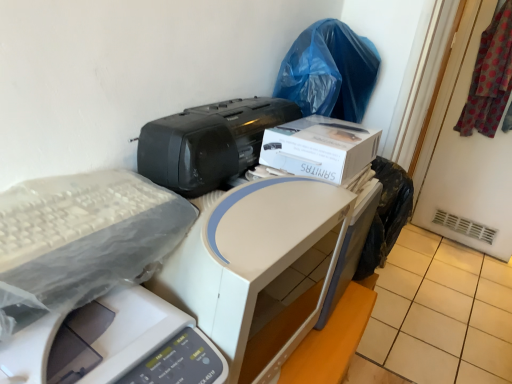
The image size is (512, 384). I want to click on empty space that is ontop of white plastic printer at center, which is the 1th printer in bottom-to-top order (from a real-world perspective), so click(x=61, y=252).